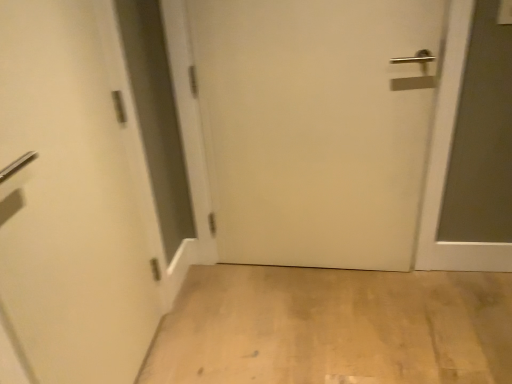
Question: Is white matte door at left, placed as the second door when sorted from right to left, in front of white matte door at center, positioned as the first door in right-to-left order?

Choices:
 (A) yes
 (B) no

Answer: (A)

Question: Does white matte door at left, placed as the second door when sorted from right to left, have a lesser width compared to white matte door at center, positioned as the first door in right-to-left order?

Choices:
 (A) yes
 (B) no

Answer: (A)

Question: Is white matte door at left, which appears as the 1th door when viewed from the left, next to white matte door at center, which appears as the second door when viewed from the left, and touching it?

Choices:
 (A) yes
 (B) no

Answer: (B)

Question: Does white matte door at left, which appears as the 1th door when viewed from the left, have a lesser height compared to white matte door at center, positioned as the first door in right-to-left order?

Choices:
 (A) no
 (B) yes

Answer: (A)

Question: Considering the relative sizes of white matte door at left, placed as the second door when sorted from right to left, and white matte door at center, positioned as the first door in right-to-left order, in the image provided, is white matte door at left, placed as the second door when sorted from right to left, smaller than white matte door at center, positioned as the first door in right-to-left order,?

Choices:
 (A) no
 (B) yes

Answer: (B)

Question: Can you confirm if white matte door at left, which appears as the 1th door when viewed from the left, is taller than white matte door at center, which appears as the second door when viewed from the left?

Choices:
 (A) no
 (B) yes

Answer: (B)

Question: Does white matte door at center, which appears as the second door when viewed from the left, have a lesser height compared to white matte door at left, which appears as the 1th door when viewed from the left?

Choices:
 (A) no
 (B) yes

Answer: (B)

Question: Is white matte door at center, positioned as the first door in right-to-left order, further to camera compared to white matte door at left, which appears as the 1th door when viewed from the left?

Choices:
 (A) no
 (B) yes

Answer: (B)

Question: Is white matte door at center, positioned as the first door in right-to-left order, bigger than white matte door at left, placed as the second door when sorted from right to left?

Choices:
 (A) no
 (B) yes

Answer: (B)

Question: Are white matte door at center, which appears as the second door when viewed from the left, and white matte door at left, which appears as the 1th door when viewed from the left, located far from each other?

Choices:
 (A) yes
 (B) no

Answer: (B)

Question: Considering the relative positions of white matte door at center, positioned as the first door in right-to-left order, and white matte door at left, which appears as the 1th door when viewed from the left, in the image provided, is white matte door at center, positioned as the first door in right-to-left order, to the right of white matte door at left, which appears as the 1th door when viewed from the left, from the viewer's perspective?

Choices:
 (A) yes
 (B) no

Answer: (A)

Question: Is white matte door at center, which appears as the second door when viewed from the left, surrounding white matte door at left, which appears as the 1th door when viewed from the left?

Choices:
 (A) no
 (B) yes

Answer: (A)

Question: Is white matte door at left, placed as the second door when sorted from right to left, to the right of light wood floor at lower center from the viewer's perspective?

Choices:
 (A) yes
 (B) no

Answer: (B)